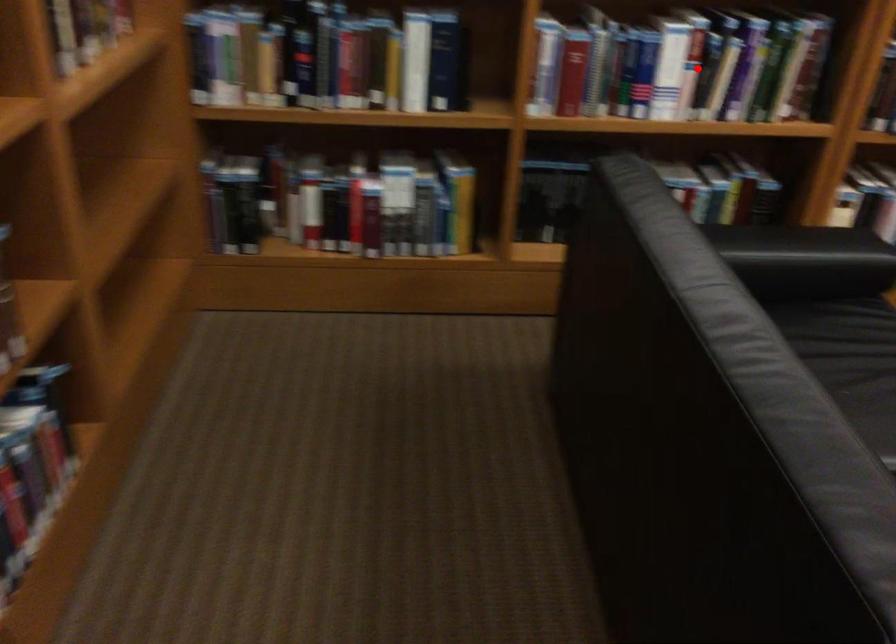
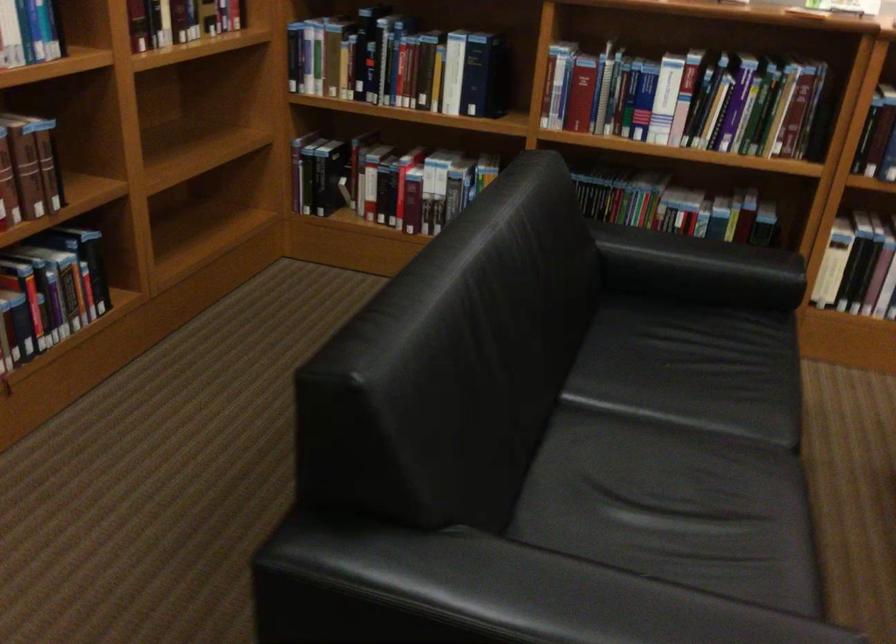
Question: I am providing you with two images of the same scene from different viewpoints. A red point is shown in image1. For the corresponding object point in image2, is it positioned nearer or farther from the camera?

Choices:
 (A) Nearer
 (B) Farther

Answer: (B)